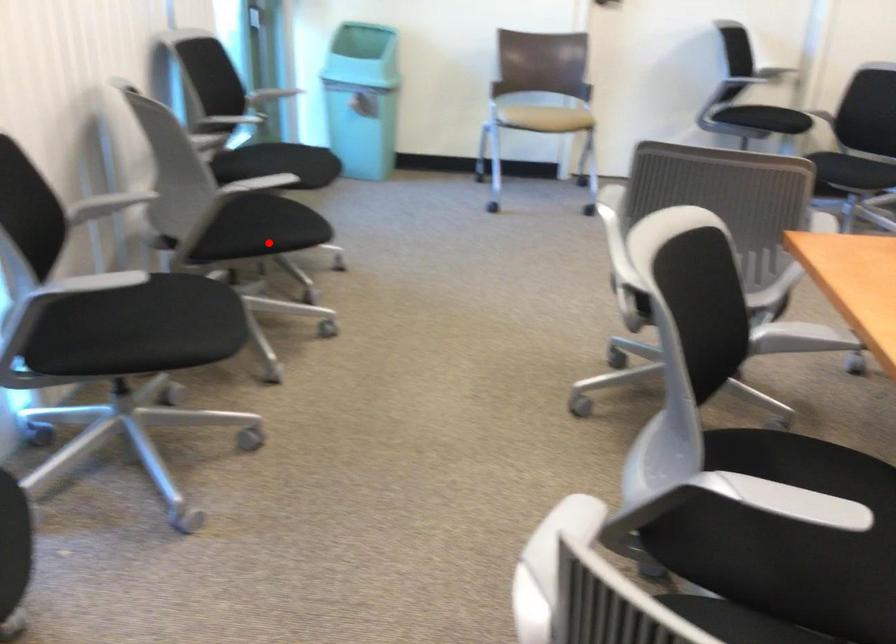
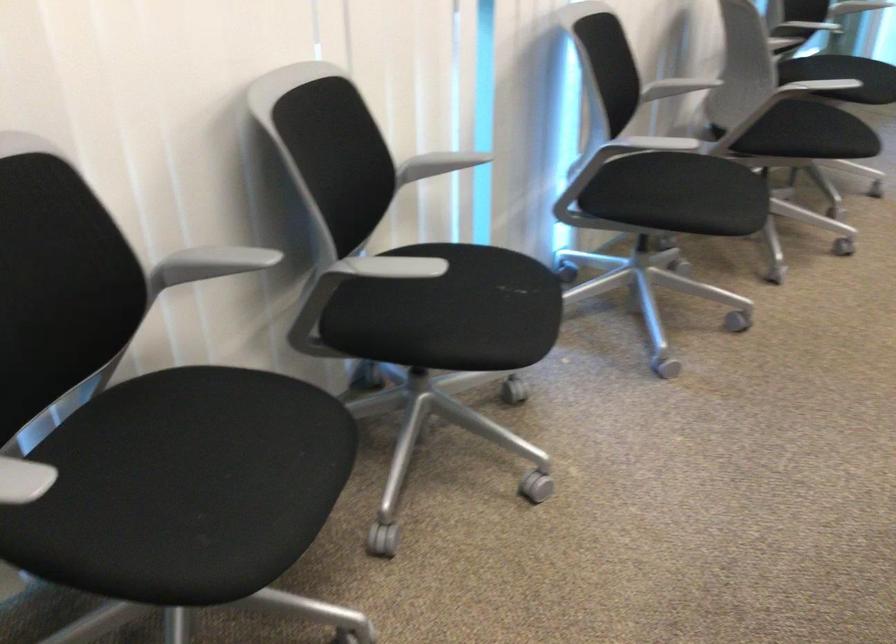
Locate, in the second image, the point that corresponds to the highlighted location in the first image.

(810, 134)